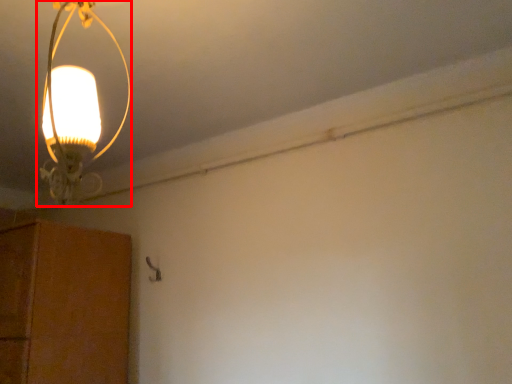
Question: In this image, where is lamp (annotated by the red box) located relative to cabinetry?

Choices:
 (A) right
 (B) left

Answer: (A)